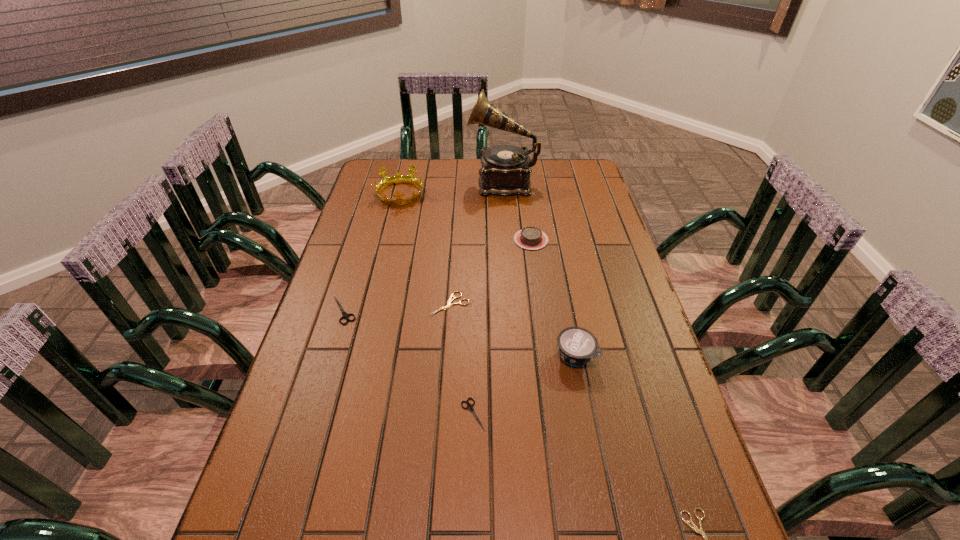
Identify the location of free space located on the front of the left beige shears. (442, 426).

The height and width of the screenshot is (540, 960). I want to click on vacant area located 0.380m on the left of the smaller black shears, so click(x=296, y=414).

I want to click on phonograph record positioned at the far edge, so click(x=505, y=171).

The width and height of the screenshot is (960, 540). I want to click on crown positioned at the far edge, so click(398, 178).

Where is `crown that is at the left edge`? The height and width of the screenshot is (540, 960). crown that is at the left edge is located at coordinates (398, 178).

You are a GUI agent. You are given a task and a screenshot of the screen. Output one action in this format:
    pyautogui.click(x=<x>, y=<y>)
    Task: Click on the shears present at the left edge
    This screenshot has height=540, width=960.
    Given the screenshot: What is the action you would take?
    pyautogui.click(x=345, y=315)

Where is `object positioned at the far left corner`? This screenshot has width=960, height=540. object positioned at the far left corner is located at coordinates (398, 178).

Image resolution: width=960 pixels, height=540 pixels. Identify the location of vacant region at the far edge of the desktop. (449, 169).

The height and width of the screenshot is (540, 960). In the image, there is a desktop. In order to click on vacant area at the left edge in this screenshot , I will do `click(345, 289)`.

The image size is (960, 540). In order to click on vacant region at the right edge of the desktop in this screenshot , I will do `click(638, 404)`.